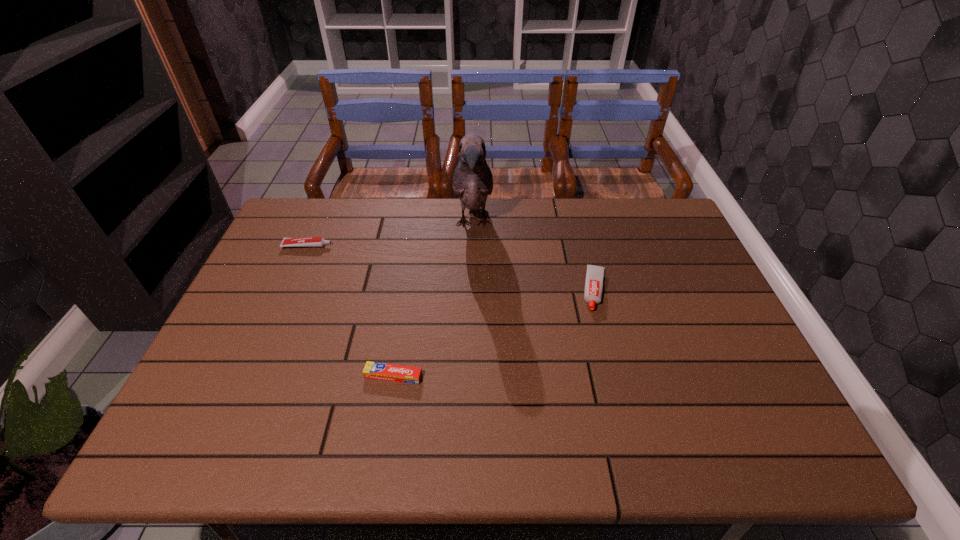
This screenshot has width=960, height=540. I want to click on the second closest object to the third tallest object, so click(373, 370).

I want to click on object that stands as the closest to the leftmost object, so click(472, 181).

Identify which toothpaste is the nearest to the second shortest object. Please provide its 2D coordinates. Your answer should be formatted as a tuple, i.e. [(x, y)], where the tuple contains the x and y coordinates of a point satisfying the conditions above.

[(373, 370)]

Image resolution: width=960 pixels, height=540 pixels. Identify the location of toothpaste that is the nearest to the farthest toothpaste. (373, 370).

At what (x,y) coordinates should I click in order to perform the action: click on free space that satisfies the following two spatial constraints: 1. on the back side of the shortest toothpaste; 2. at the nozzle of the second tallest toothpaste. Please return your answer as a coordinate pair (x, y). Looking at the image, I should click on (415, 246).

You are a GUI agent. You are given a task and a screenshot of the screen. Output one action in this format:
    pyautogui.click(x=<x>, y=<y>)
    Task: Click on the vacant point that satisfies the following two spatial constraints: 1. at the nozzle of the nearest toothpaste; 2. on the right side of the leftmost toothpaste
    Image resolution: width=960 pixels, height=540 pixels.
    Given the screenshot: What is the action you would take?
    pyautogui.click(x=251, y=376)

Identify the location of vacant space that satisfies the following two spatial constraints: 1. on the front-facing side of the tallest object; 2. at the nozzle of the leftmost toothpaste. The height and width of the screenshot is (540, 960). (473, 246).

This screenshot has height=540, width=960. In order to click on free space in the image that satisfies the following two spatial constraints: 1. at the nozzle of the leftmost object; 2. on the left side of the nearest object in this screenshot , I will do `click(251, 376)`.

The image size is (960, 540). Find the location of `vacant point that satisfies the following two spatial constraints: 1. at the nozzle of the third tallest object; 2. on the back side of the shortest toothpaste`. vacant point that satisfies the following two spatial constraints: 1. at the nozzle of the third tallest object; 2. on the back side of the shortest toothpaste is located at coordinates (251, 376).

Where is `free location that satisfies the following two spatial constraints: 1. on the front-facing side of the parrot; 2. on the right side of the rightmost toothpaste`? The height and width of the screenshot is (540, 960). free location that satisfies the following two spatial constraints: 1. on the front-facing side of the parrot; 2. on the right side of the rightmost toothpaste is located at coordinates (472, 290).